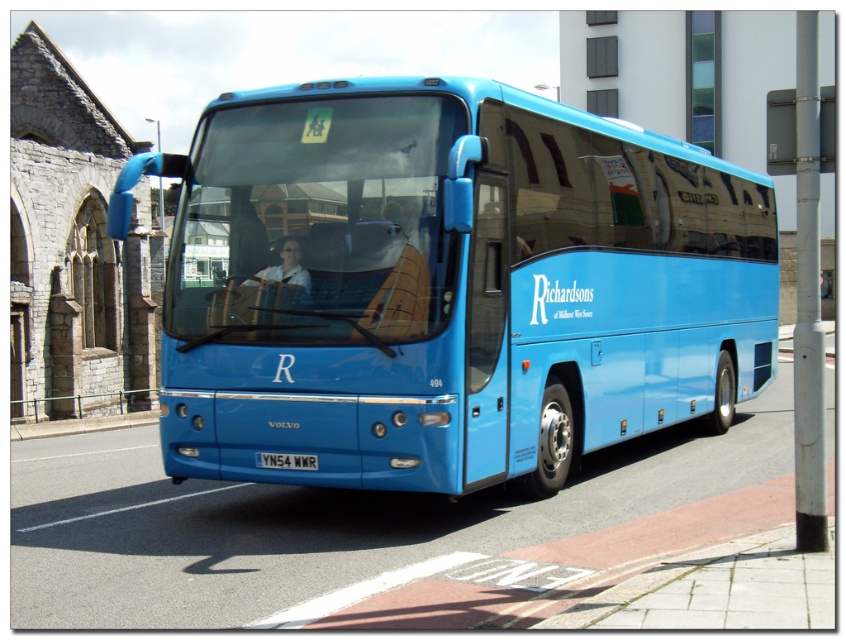
Can you confirm if blue metallic bus at center is positioned to the left of white glossy shirt at center?

Correct, you'll find blue metallic bus at center to the left of white glossy shirt at center.

Is point (235, 141) positioned behind point (297, 257)?

Yes, it is behind point (297, 257).

Where is `blue metallic bus at center`? The width and height of the screenshot is (846, 640). blue metallic bus at center is located at coordinates (449, 285).

Can you confirm if blue metallic bus at center is positioned below white plastic license plate at center?

Incorrect, blue metallic bus at center is not positioned below white plastic license plate at center.

Consider the image. Who is more distant from viewer, (656, 260) or (262, 461)?

The point (656, 260) is behind.

Measure the distance between point (x=416, y=172) and camera.

A distance of 6.91 meters exists between point (x=416, y=172) and camera.

Find the location of a particular element. The image size is (846, 640). blue metallic bus at center is located at coordinates (449, 285).

Does white glossy shirt at center appear over white plastic license plate at center?

Indeed, white glossy shirt at center is positioned over white plastic license plate at center.

Who is more forward, [287,264] or [275,461]?

Point [275,461] is more forward.

Where is `white glossy shirt at center`? The image size is (846, 640). white glossy shirt at center is located at coordinates (283, 268).